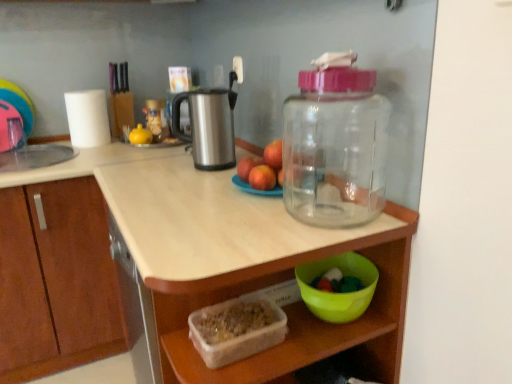
Question: Is red matte apple at center looking in the opposite direction of white matte paper towel at upper left?

Choices:
 (A) yes
 (B) no

Answer: (B)

Question: Is red matte apple at center not within white matte paper towel at upper left?

Choices:
 (A) yes
 (B) no

Answer: (A)

Question: Does red matte apple at center have a lesser width compared to white matte paper towel at upper left?

Choices:
 (A) yes
 (B) no

Answer: (A)

Question: Can you confirm if red matte apple at center is positioned to the left of white matte paper towel at upper left?

Choices:
 (A) yes
 (B) no

Answer: (B)

Question: Considering the relative sizes of red matte apple at center and white matte paper towel at upper left in the image provided, is red matte apple at center wider than white matte paper towel at upper left?

Choices:
 (A) no
 (B) yes

Answer: (A)

Question: Considering the relative sizes of red matte apple at center and white matte paper towel at upper left in the image provided, is red matte apple at center bigger than white matte paper towel at upper left?

Choices:
 (A) yes
 (B) no

Answer: (B)

Question: Is translucent plastic container at lower center thinner than brushed metal electric kettle at upper center?

Choices:
 (A) yes
 (B) no

Answer: (B)

Question: Is translucent plastic container at lower center further to the viewer compared to brushed metal electric kettle at upper center?

Choices:
 (A) yes
 (B) no

Answer: (B)

Question: Is brushed metal electric kettle at upper center a part of translucent plastic container at lower center?

Choices:
 (A) no
 (B) yes

Answer: (A)

Question: From a real-world perspective, is translucent plastic container at lower center positioned over brushed metal electric kettle at upper center based on gravity?

Choices:
 (A) yes
 (B) no

Answer: (B)

Question: From the image's perspective, is translucent plastic container at lower center above brushed metal electric kettle at upper center?

Choices:
 (A) yes
 (B) no

Answer: (B)

Question: Is translucent plastic container at lower center to the right of brushed metal electric kettle at upper center from the viewer's perspective?

Choices:
 (A) yes
 (B) no

Answer: (A)

Question: Is green plastic bowl at lower right, which is the 1th bowl in right-to-left order, oriented towards translucent plastic container at lower center?

Choices:
 (A) no
 (B) yes

Answer: (B)